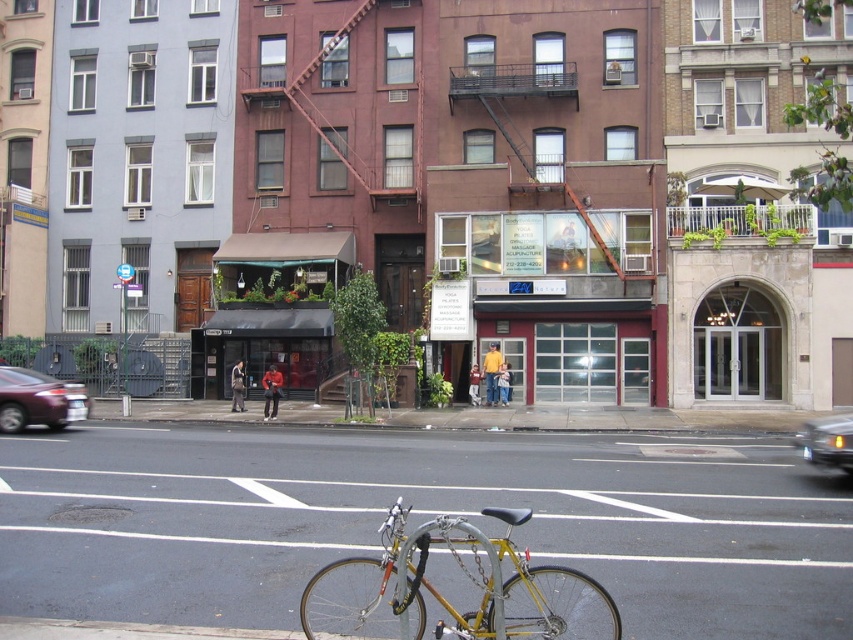
You are a delivery person who needs to park your gold metallic bicycle at center and metallic silver car at center right in a narrow alleyway. The alleyway is only 1.2 meters wide. Can both vehicles fit side by side?

The gold metallic bicycle at center has a lesser width compared to metallic silver car at center right. Since the alleyway is 1.2 meters wide, and the bicycle is narrower than the car, it depends on the combined width of both. However, without knowing the exact widths, we cannot confirm if they can fit. Please check the total width required.

You are a delivery person needing to park your vehicle temporarily. You see a gold metallic bicycle at center and a metallic silver car at center right. Which vehicle takes up more space in the parking area?

The metallic silver car at center right takes up more space than the gold metallic bicycle at center because the gold metallic bicycle at center occupies less space than metallic silver car at center right.